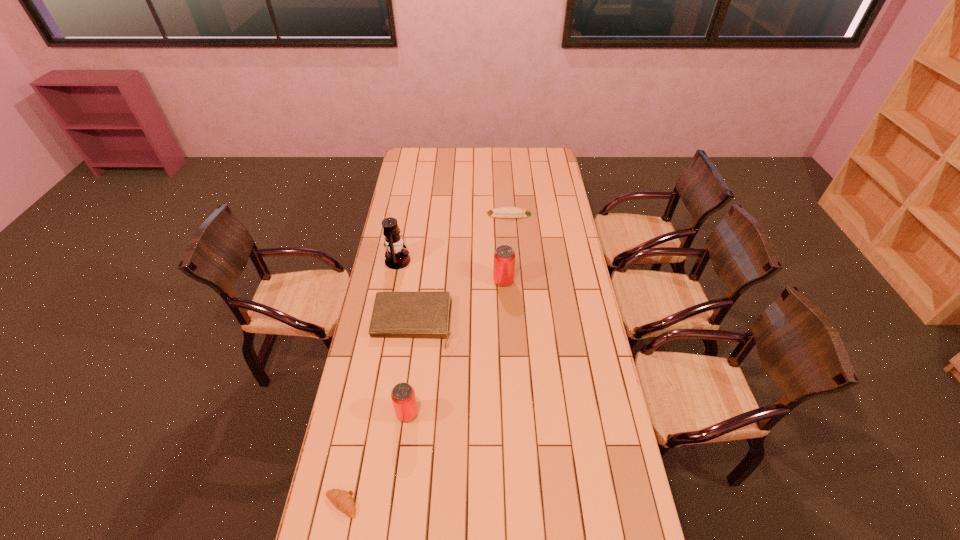
Where is `free spot that satisfies the following two spatial constraints: 1. at the bitten end of the burrito; 2. on the front side of the crescent roll`? The image size is (960, 540). free spot that satisfies the following two spatial constraints: 1. at the bitten end of the burrito; 2. on the front side of the crescent roll is located at coordinates (530, 504).

The height and width of the screenshot is (540, 960). Identify the location of vacant space that satisfies the following two spatial constraints: 1. on the spine side of the fifth farthest object; 2. on the right side of the paperback book. (400, 414).

You are a GUI agent. You are given a task and a screenshot of the screen. Output one action in this format:
    pyautogui.click(x=<x>, y=<y>)
    Task: Click on the free space in the image that satisfies the following two spatial constraints: 1. at the bitten end of the farthest object; 2. on the front side of the left can
    
    Given the screenshot: What is the action you would take?
    pyautogui.click(x=523, y=414)